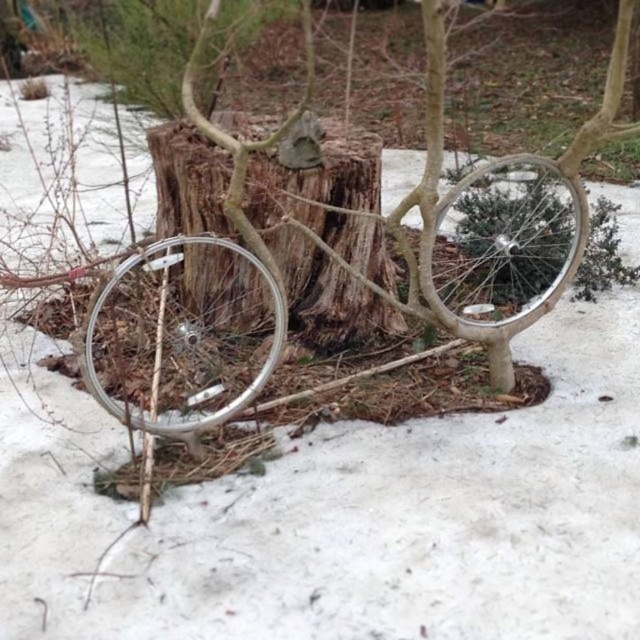
Question: Is silver metallic bicycle at center wider than silver metallic wheel at center?

Choices:
 (A) yes
 (B) no

Answer: (B)

Question: Which point appears farthest from the camera in this image?

Choices:
 (A) (570, 262)
 (B) (131, 310)

Answer: (B)

Question: Does silver metallic bicycle at center appear over wooden tree stump at center?

Choices:
 (A) no
 (B) yes

Answer: (A)

Question: Can you confirm if silver metallic wheel at left is positioned above silver metallic wheel at center?

Choices:
 (A) yes
 (B) no

Answer: (B)

Question: Which object appears farthest from the camera in this image?

Choices:
 (A) wooden tree stump at center
 (B) silver metallic wheel at left
 (C) silver metallic wheel at center
 (D) silver metallic bicycle at center

Answer: (A)

Question: Estimate the real-world distances between objects in this image. Which object is closer to the silver metallic wheel at left?

Choices:
 (A) wooden tree stump at center
 (B) silver metallic bicycle at center

Answer: (A)